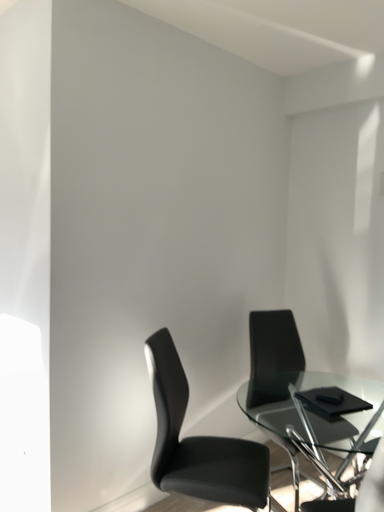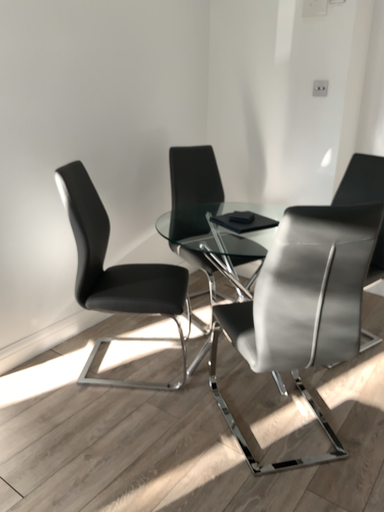
Question: How did the camera likely rotate when shooting the video?

Choices:
 (A) rotated left
 (B) rotated right

Answer: (B)